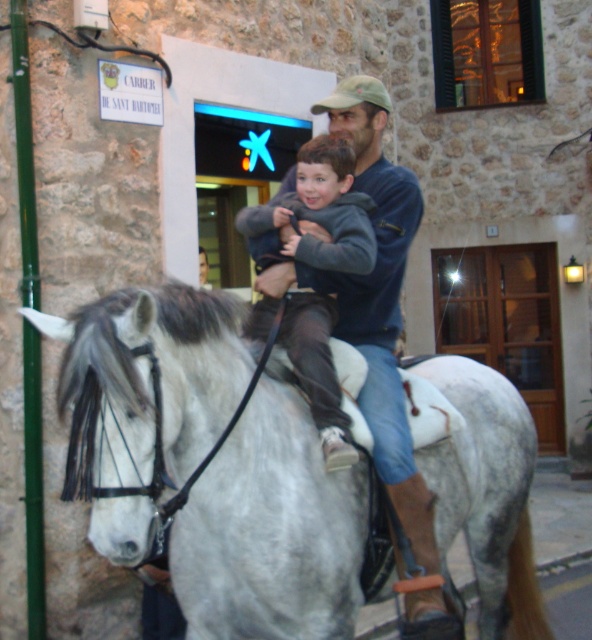
You are a photographer standing in the street and want to take a photo of the blue denim jacket at center and the gray fleece jacket at center. Which jacket is closer to you?

The blue denim jacket at center is closer to you since it is further to the viewer than the gray fleece jacket at center.